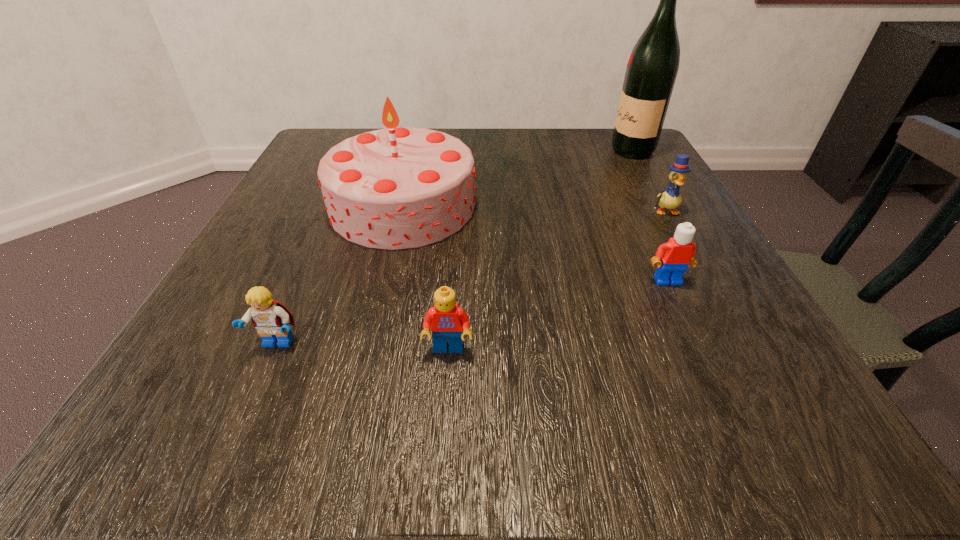
This screenshot has height=540, width=960. Find the location of `free space at the near left corner`. free space at the near left corner is located at coordinates click(x=204, y=392).

Find the location of a particular element. free region at the far right corner of the desktop is located at coordinates (660, 169).

In order to click on blank region between the leftmost Lego and the rightmost Lego in this screenshot , I will do `click(472, 312)`.

The image size is (960, 540). In order to click on free spot between the duckling and the second Lego from right to left in this screenshot , I will do `click(557, 280)`.

The height and width of the screenshot is (540, 960). Identify the location of vacant area that lies between the second tallest object and the farthest object. (517, 178).

The image size is (960, 540). Identify the location of free space between the second tallest object and the second Lego from right to left. (425, 276).

Locate an element on the screen. This screenshot has height=540, width=960. free spot between the second tallest object and the third nearest object is located at coordinates (536, 242).

I want to click on vacant region between the rightmost Lego and the second Lego from right to left, so click(x=558, y=314).

This screenshot has height=540, width=960. What are the coordinates of `free spot between the fifth shortest object and the duckling` in the screenshot? It's located at (535, 208).

This screenshot has height=540, width=960. What are the coordinates of `vacant space in between the duckling and the fifth shortest object` in the screenshot? It's located at (535, 208).